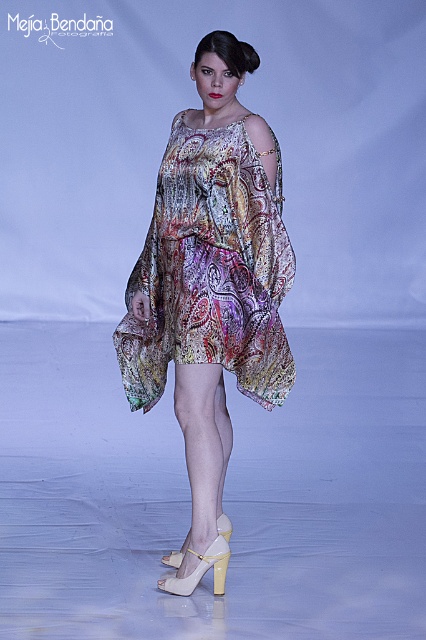
Is multicolored sheer dress at center behind white leather sandal at center?

No.

Between multicolored sheer dress at center and white leather sandal at center, which one is positioned higher?

Positioned higher is multicolored sheer dress at center.

Between point (239, 189) and point (218, 579), which one is positioned behind?

The point (218, 579) is behind.

Image resolution: width=426 pixels, height=640 pixels. Find the location of `multicolored sheer dress at center`. multicolored sheer dress at center is located at coordinates (210, 269).

Based on the photo, can you confirm if white leather sandal at center is thinner than white leather high-heeled shoe at center?

Yes.

Can you confirm if white leather sandal at center is positioned to the right of white leather high-heeled shoe at center?

Yes, white leather sandal at center is to the right of white leather high-heeled shoe at center.

Measure the distance between white leather sandal at center and camera.

white leather sandal at center and camera are 9.68 feet apart.

The image size is (426, 640). I want to click on white leather sandal at center, so [x=203, y=568].

Image resolution: width=426 pixels, height=640 pixels. What do you see at coordinates (210, 269) in the screenshot?
I see `multicolored sheer dress at center` at bounding box center [210, 269].

The height and width of the screenshot is (640, 426). I want to click on multicolored sheer dress at center, so click(210, 269).